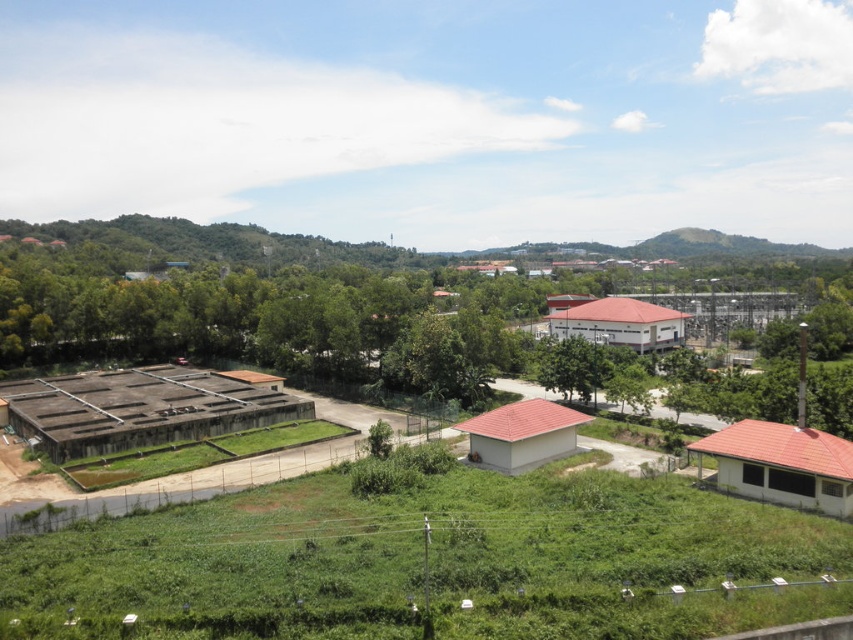
Looking at this image, you are navigating a drone over the semi urban landscape shown in the image. The drone must avoid the green leafy tree at center. What are the coordinates to fly around it?

The green leafy tree at center is located at point (379,316). To fly around it, the drone should adjust its path to avoid these coordinates.

You are a landscape architect designing a new park. You have to decide where to place a large statue. The statue requires a space that can accommodate its size. Given the green leafy tree at center and the green grassy hillside at center, which location would be more suitable for the statue based on their sizes?

The green leafy tree at center is bigger than the green grassy hillside at center, so the statue should be placed near the green grassy hillside at center since it can better accommodate the statue.

From the picture: You are standing at the edge of the grassy area looking towards the industrial complex. You see the green leafy tree at center and the green grassy hillside at center. Which object is positioned to the left when facing the industrial complex?

The green leafy tree at center is to the left of the green grassy hillside at center when facing the industrial complex.